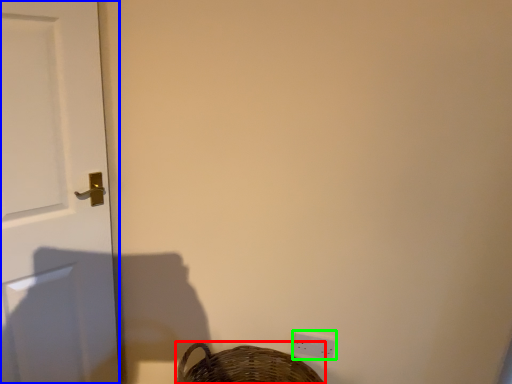
Question: Which object is the closest to the basket (highlighted by a red box)? Choose among these: door (highlighted by a blue box) or light switch (highlighted by a green box).

Choices:
 (A) door
 (B) light switch

Answer: (B)